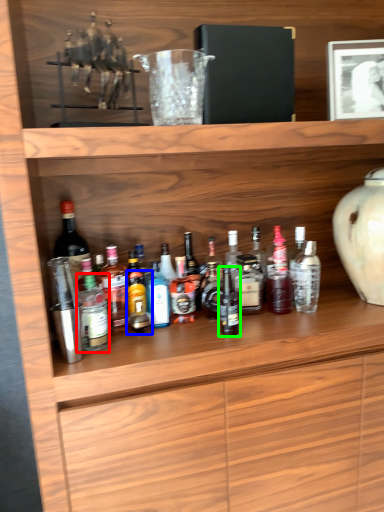
Question: Which object is the farthest from bottle (highlighted by a red box)? Choose among these: bottle (highlighted by a blue box) or bottle (highlighted by a green box).

Choices:
 (A) bottle
 (B) bottle

Answer: (B)